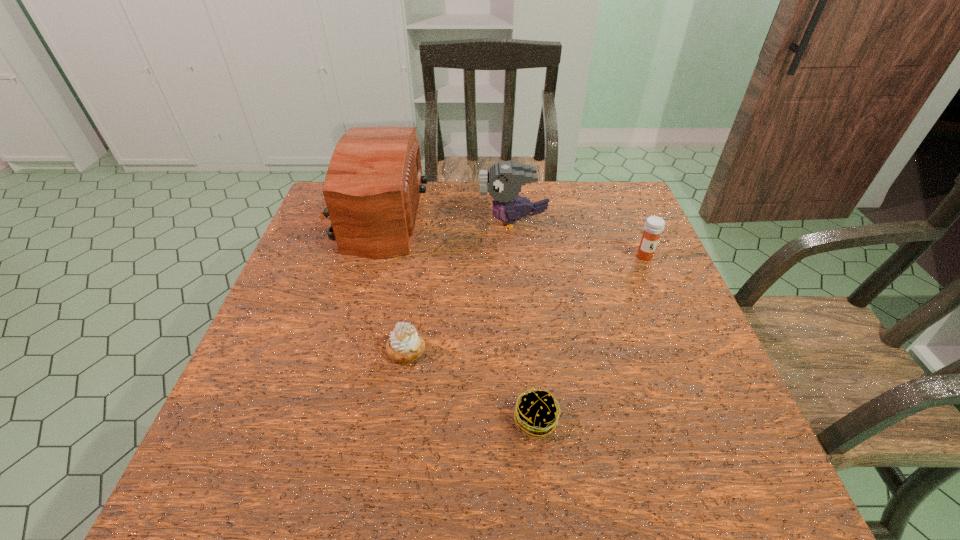
The image size is (960, 540). Find the location of `vacant position at the left edge of the desktop`. vacant position at the left edge of the desktop is located at coordinates (347, 286).

The width and height of the screenshot is (960, 540). In the image, there is a desktop. Find the location of `blank space at the near left corner`. blank space at the near left corner is located at coordinates pyautogui.click(x=204, y=503).

Where is `vacant space at the near right corner of the desktop`? The image size is (960, 540). vacant space at the near right corner of the desktop is located at coordinates (712, 453).

At what (x,y) coordinates should I click in order to perform the action: click on free point between the patty and the tallest object. Please return your answer as a coordinate pair (x, y). Looking at the image, I should click on (454, 319).

Identify the location of empty location between the medicine and the second nearest object. (525, 303).

What are the coordinates of `free point between the rightmost object and the nearest object` in the screenshot? It's located at (590, 338).

Find the location of a particular element. Image resolution: width=960 pixels, height=540 pixels. vacant space in between the tallest object and the fourth shortest object is located at coordinates (443, 220).

Locate an element on the screen. This screenshot has width=960, height=540. vacant space in between the third tallest object and the pastry is located at coordinates (525, 303).

Where is `vacant area that lies between the bird and the nearest object`? The image size is (960, 540). vacant area that lies between the bird and the nearest object is located at coordinates (525, 321).

At what (x,y) coordinates should I click in order to perform the action: click on empty space between the bird and the second nearest object. Please return your answer as a coordinate pair (x, y). Looking at the image, I should click on (460, 286).